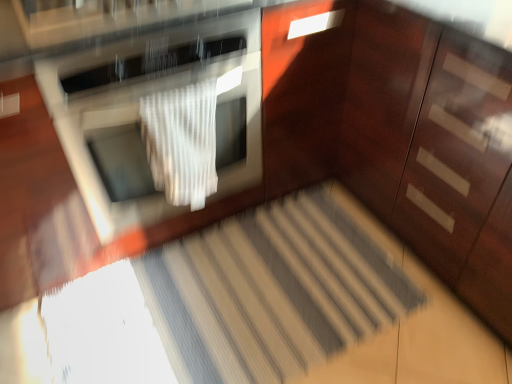
Question: Considering the relative positions of satin silver oven at center and glossy wood dresser at right in the image provided, is satin silver oven at center to the right of glossy wood dresser at right from the viewer's perspective?

Choices:
 (A) no
 (B) yes

Answer: (A)

Question: Are satin silver oven at center and glossy wood dresser at right making contact?

Choices:
 (A) no
 (B) yes

Answer: (A)

Question: Considering the relative sizes of satin silver oven at center and glossy wood dresser at right in the image provided, is satin silver oven at center bigger than glossy wood dresser at right?

Choices:
 (A) yes
 (B) no

Answer: (B)

Question: Is satin silver oven at center positioned with its back to glossy wood dresser at right?

Choices:
 (A) yes
 (B) no

Answer: (B)

Question: Is satin silver oven at center positioned beyond the bounds of glossy wood dresser at right?

Choices:
 (A) yes
 (B) no

Answer: (A)

Question: Is satin silver oven at center oriented towards glossy wood dresser at right?

Choices:
 (A) yes
 (B) no

Answer: (B)

Question: From the image's perspective, is glossy wood dresser at right over striped carpet at center?

Choices:
 (A) yes
 (B) no

Answer: (A)

Question: Considering the relative positions of glossy wood dresser at right and striped carpet at center in the image provided, is glossy wood dresser at right to the left of striped carpet at center from the viewer's perspective?

Choices:
 (A) yes
 (B) no

Answer: (B)

Question: From a real-world perspective, is glossy wood dresser at right on striped carpet at center?

Choices:
 (A) yes
 (B) no

Answer: (A)

Question: Is glossy wood dresser at right bigger than striped carpet at center?

Choices:
 (A) yes
 (B) no

Answer: (A)

Question: From a real-world perspective, is glossy wood dresser at right under striped carpet at center?

Choices:
 (A) yes
 (B) no

Answer: (B)

Question: Considering the relative positions of glossy wood dresser at right and striped carpet at center in the image provided, is glossy wood dresser at right to the right of striped carpet at center from the viewer's perspective?

Choices:
 (A) yes
 (B) no

Answer: (A)

Question: Is white textured blanket at center further to the viewer compared to striped carpet at center?

Choices:
 (A) yes
 (B) no

Answer: (B)